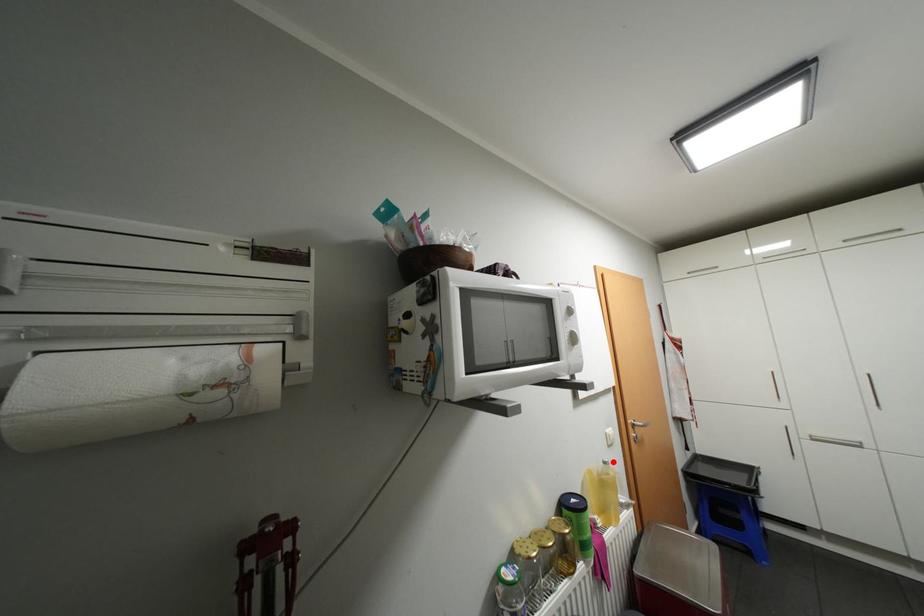
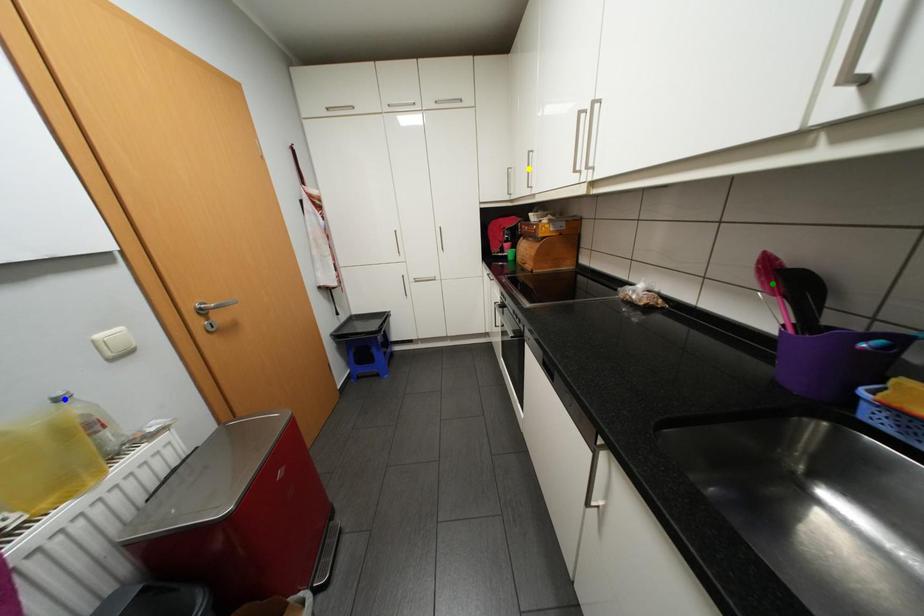
Question: I am providing you with two images of the same scene from different viewpoints. A red point is marked on the first image. You are given multiple points on the second image. Which point in image 2 is actually the same real-world point as the red point in image 1?

Choices:
 (A) blue point
 (B) yellow point
 (C) green point

Answer: (A)